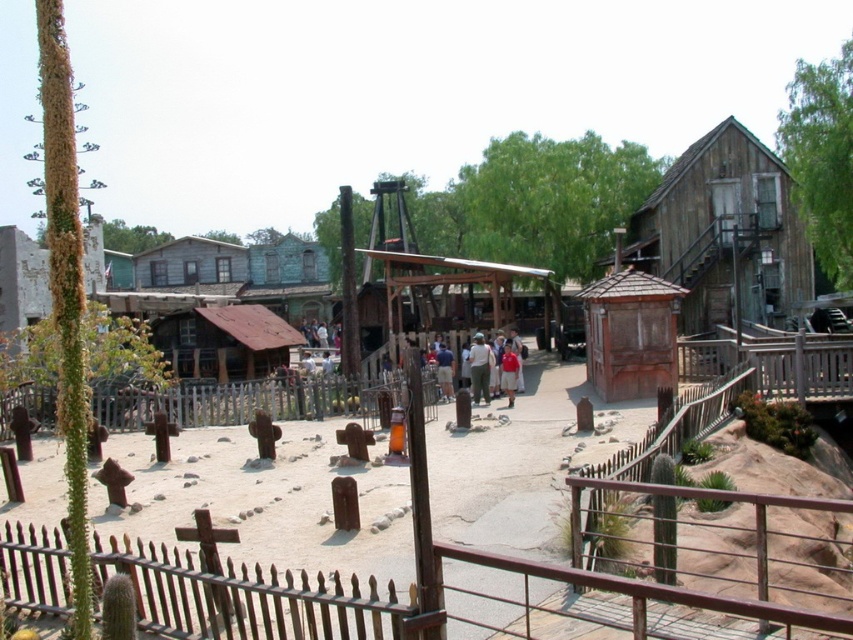
Is weathered wood cabin at upper right thinner than wooden cabin at center?

Incorrect, weathered wood cabin at upper right's width is not less than wooden cabin at center's.

Who is positioned more to the left, weathered wood cabin at upper right or wooden cabin at center?

From the viewer's perspective, wooden cabin at center appears more on the left side.

Which is in front, point (722, 323) or point (612, 349)?

Point (612, 349) is more forward.

This screenshot has width=853, height=640. Find the location of `weathered wood cabin at upper right`. weathered wood cabin at upper right is located at coordinates (724, 232).

Between matte white shirt at center and light blue shirt at center, which one has less height?

light blue shirt at center

Is matte white shirt at center to the right of light blue shirt at center from the viewer's perspective?

Yes, matte white shirt at center is to the right of light blue shirt at center.

Where is `matte white shirt at center`? The width and height of the screenshot is (853, 640). matte white shirt at center is located at coordinates click(494, 365).

How far apart are wooden cabin at center and matte white shirt at center?

wooden cabin at center is 10.15 feet from matte white shirt at center.

Is wooden cabin at center shorter than matte white shirt at center?

Indeed, wooden cabin at center has a lesser height compared to matte white shirt at center.

Does point (610, 360) come farther from viewer compared to point (520, 364)?

No, (610, 360) is closer to viewer.

I want to click on wooden cabin at center, so click(630, 333).